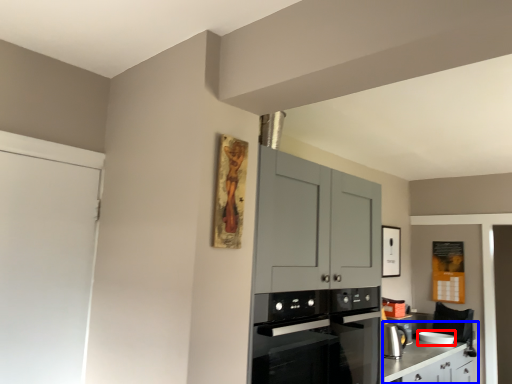
Question: Which of the following is the farthest to the observer, appliance (highlighted by a red box) or counter (highlighted by a blue box)?

Choices:
 (A) appliance
 (B) counter

Answer: (A)